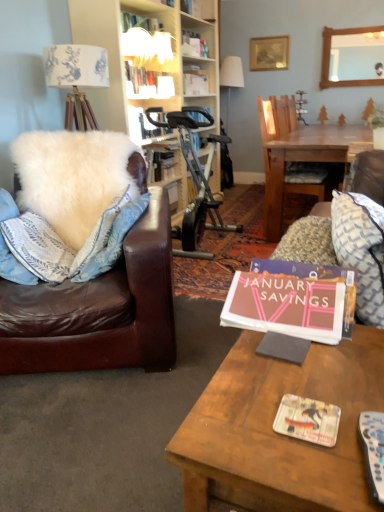
The image size is (384, 512). Find the location of `vacant region to the left of matte paper magazine at center`. vacant region to the left of matte paper magazine at center is located at coordinates (241, 420).